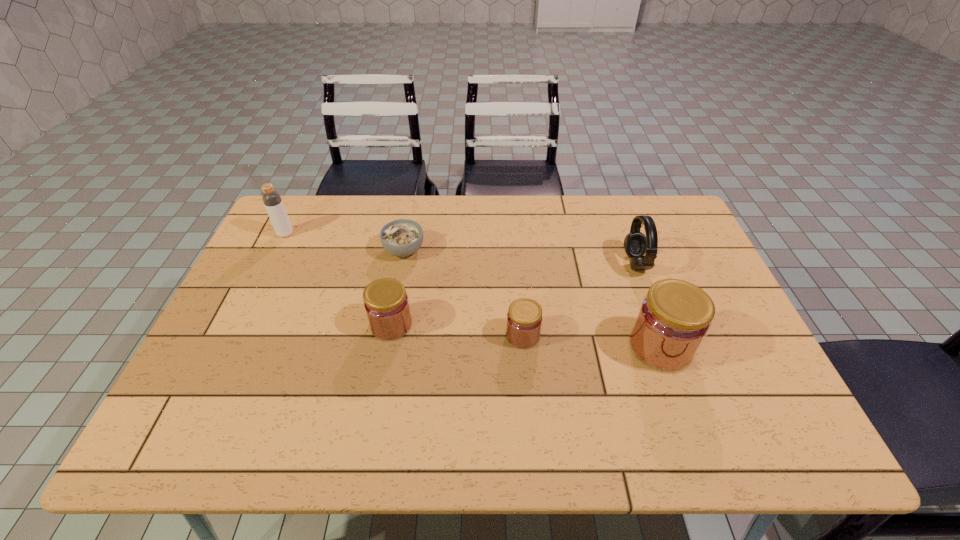
Observe the arrangement of all jams in the image. To keep them evenly spaced, where would you place another jam on the left? Please locate a free space. Please provide its 2D coordinates. Your answer should be formatted as a tuple, i.e. [(x, y)], where the tuple contains the x and y coordinates of a point satisfying the conditions above.

[(266, 314)]